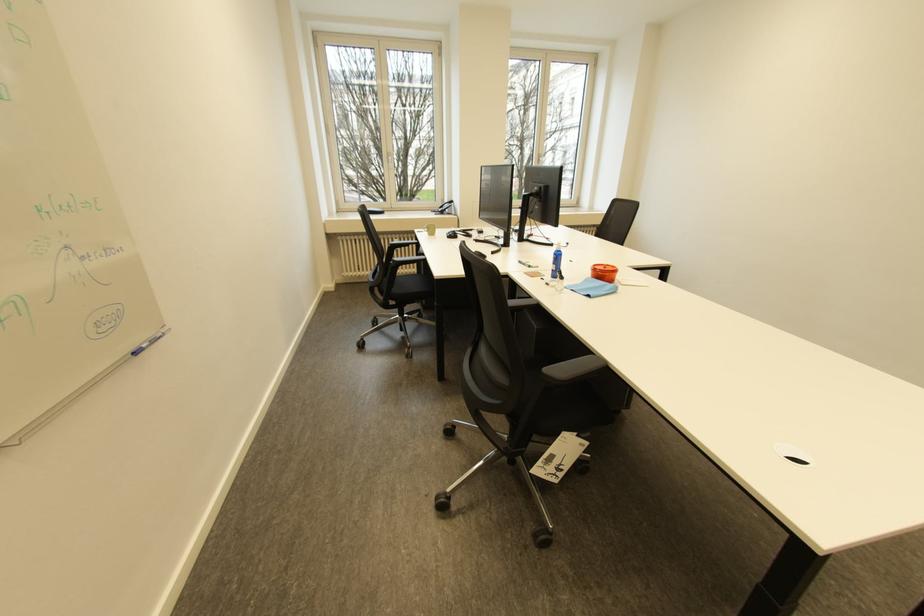
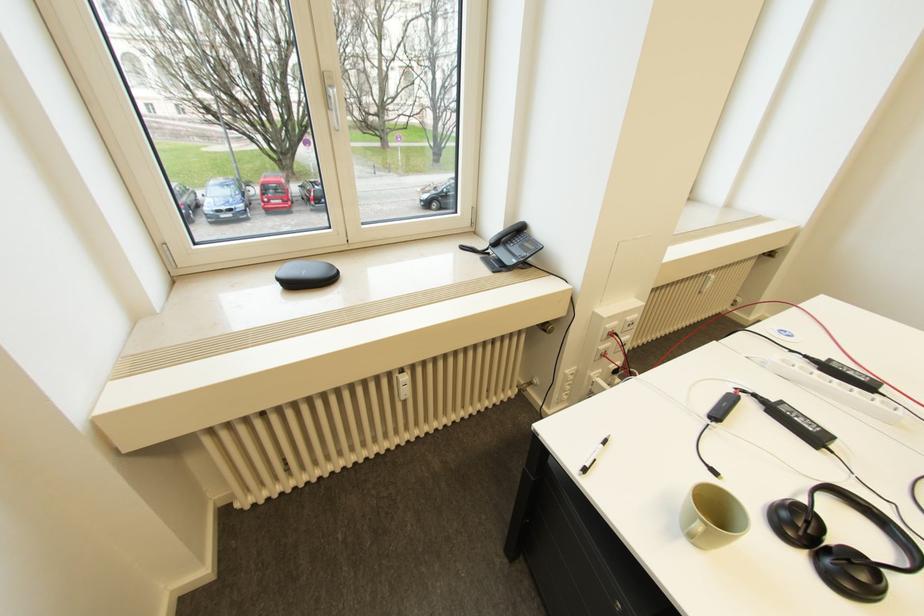
Question: What movement of the cameraman would produce the second image?

Choices:
 (A) Left
 (B) Right
 (C) Forward
 (D) Backward

Answer: (C)